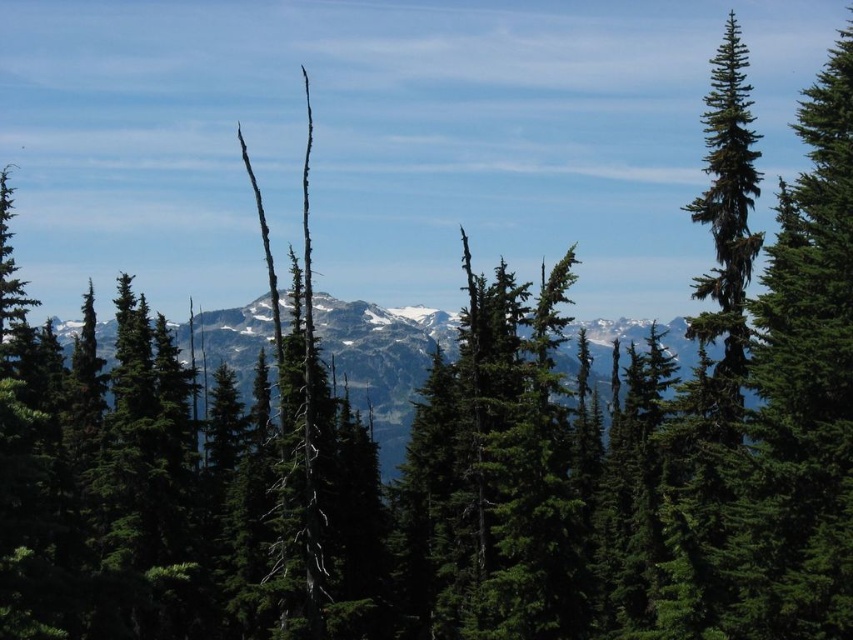
You are a hiker planning to navigate through the dense evergreen forest in the mountainous landscape. You have two markers, one at point (486, 570) and another at point (244, 369). Which marker should you prioritize visiting first if you want to reach the nearest visible mountain peak as quickly as possible?

Point (486, 570) is in front of point (244, 369), so you should prioritize visiting point (486, 570) first to reach the nearest visible mountain peak more quickly.